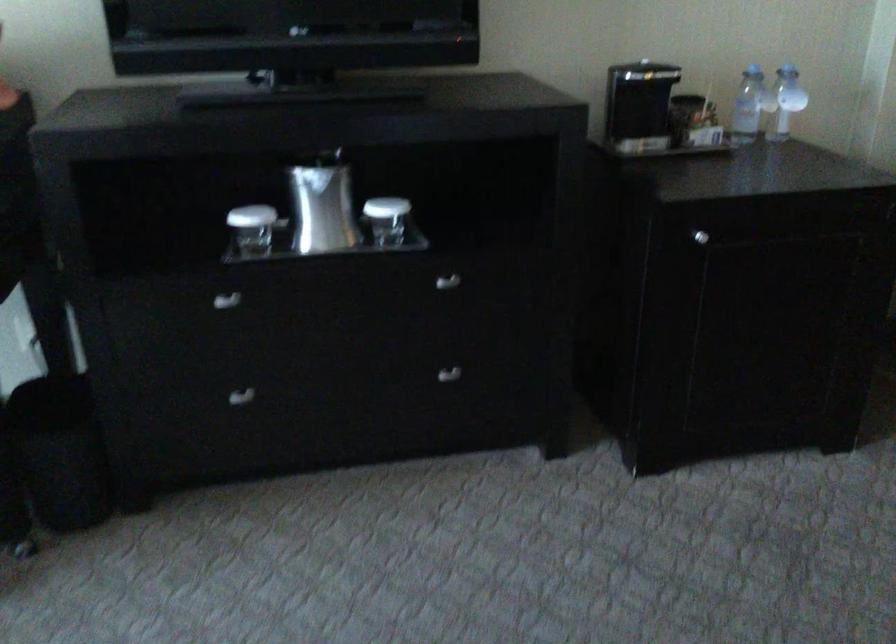
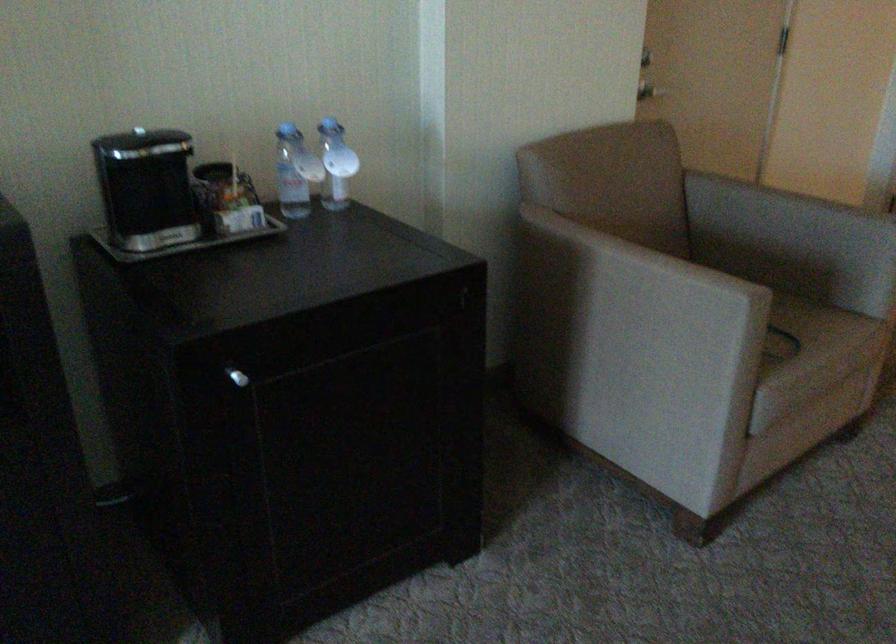
In the second image, find the point that corresponds to the point at 639,102 in the first image.

(149, 194)